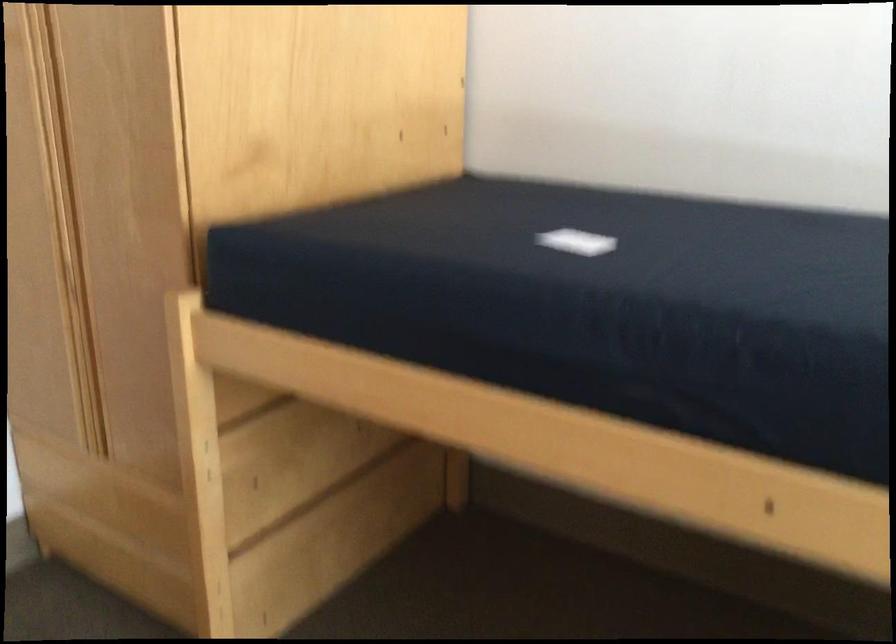
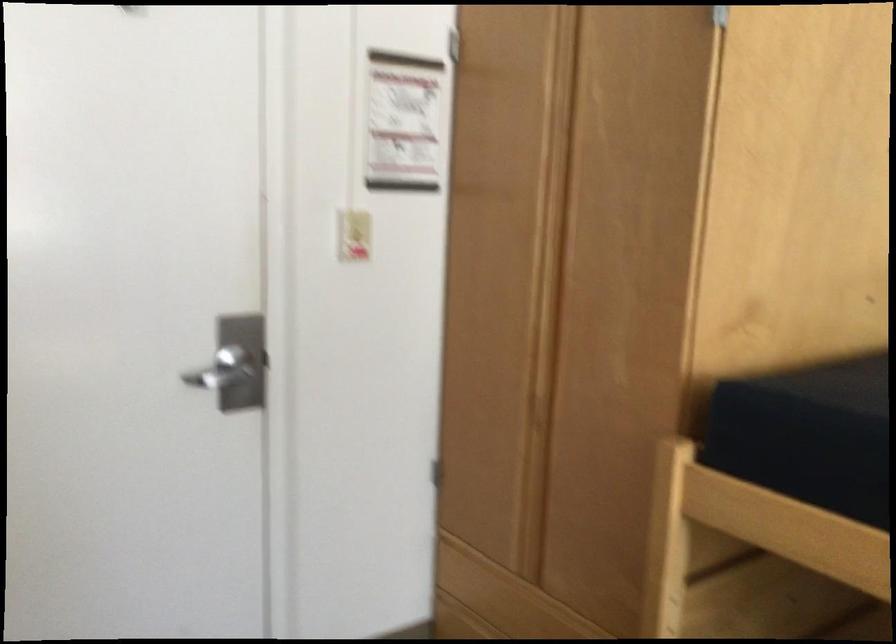
Question: Based on the continuous images, in which direction is the camera rotating? Reply with the corresponding letter.

Choices:
 (A) Left
 (B) Right
 (C) Up
 (D) Down

Answer: (A)